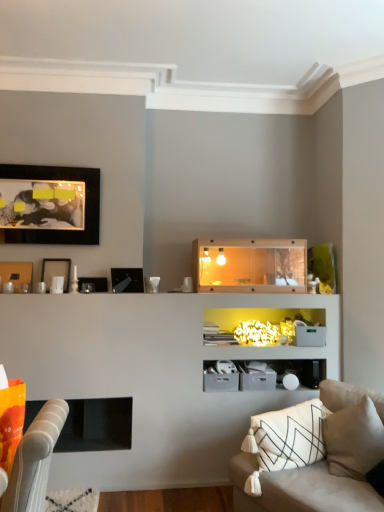
Question: Is matte black picture frame at upper left, the fourth picture frame from the bottom, thinner than beige fabric couch at lower right?

Choices:
 (A) no
 (B) yes

Answer: (B)

Question: From the image's perspective, is matte black picture frame at upper left, arranged as the 1th picture frame when viewed from the top, beneath beige fabric couch at lower right?

Choices:
 (A) no
 (B) yes

Answer: (A)

Question: Is there a large distance between matte black picture frame at upper left, the fourth picture frame from the bottom, and beige fabric couch at lower right?

Choices:
 (A) yes
 (B) no

Answer: (A)

Question: Is matte black picture frame at upper left, arranged as the 1th picture frame when viewed from the top, bigger than beige fabric couch at lower right?

Choices:
 (A) yes
 (B) no

Answer: (B)

Question: Does matte black picture frame at upper left, the fourth picture frame from the bottom, appear on the left side of beige fabric couch at lower right?

Choices:
 (A) no
 (B) yes

Answer: (B)

Question: Considering the positions of metallic black picture frame at upper left, the 2th picture frame when ordered from bottom to top, and wooden shelf at center in the image, is metallic black picture frame at upper left, the 2th picture frame when ordered from bottom to top, wider or thinner than wooden shelf at center?

Choices:
 (A) wide
 (B) thin

Answer: (B)

Question: Would you say metallic black picture frame at upper left, the 3th picture frame positioned from the top, is to the left or to the right of wooden shelf at center in the picture?

Choices:
 (A) left
 (B) right

Answer: (A)

Question: Is point (142, 289) positioned closer to the camera than point (200, 257)?

Choices:
 (A) closer
 (B) farther

Answer: (B)

Question: Based on their sizes in the image, would you say metallic black picture frame at upper left, the 2th picture frame when ordered from bottom to top, is bigger or smaller than wooden shelf at center?

Choices:
 (A) small
 (B) big

Answer: (A)

Question: From the image's perspective, is wooden shelf at center above or below matte black picture frame at upper left, the first picture frame positioned from the bottom?

Choices:
 (A) below
 (B) above

Answer: (B)

Question: From a real-world perspective, is wooden shelf at center positioned above or below matte black picture frame at upper left, positioned as the fourth picture frame in top-to-bottom order?

Choices:
 (A) above
 (B) below

Answer: (A)

Question: Relative to matte black picture frame at upper left, the first picture frame positioned from the bottom, is wooden shelf at center in front or behind?

Choices:
 (A) front
 (B) behind

Answer: (A)

Question: Based on their sizes in the image, would you say wooden shelf at center is bigger or smaller than matte black picture frame at upper left, positioned as the fourth picture frame in top-to-bottom order?

Choices:
 (A) big
 (B) small

Answer: (A)

Question: Looking at their shapes, would you say white matte picture frame at upper left, which is the second picture frame from top to bottom, is wider or thinner than matte black picture frame at upper left, positioned as the fourth picture frame in top-to-bottom order?

Choices:
 (A) thin
 (B) wide

Answer: (B)

Question: From the image's perspective, is white matte picture frame at upper left, the 3th picture frame in the bottom-to-top sequence, positioned above or below matte black picture frame at upper left, the first picture frame positioned from the bottom?

Choices:
 (A) above
 (B) below

Answer: (A)